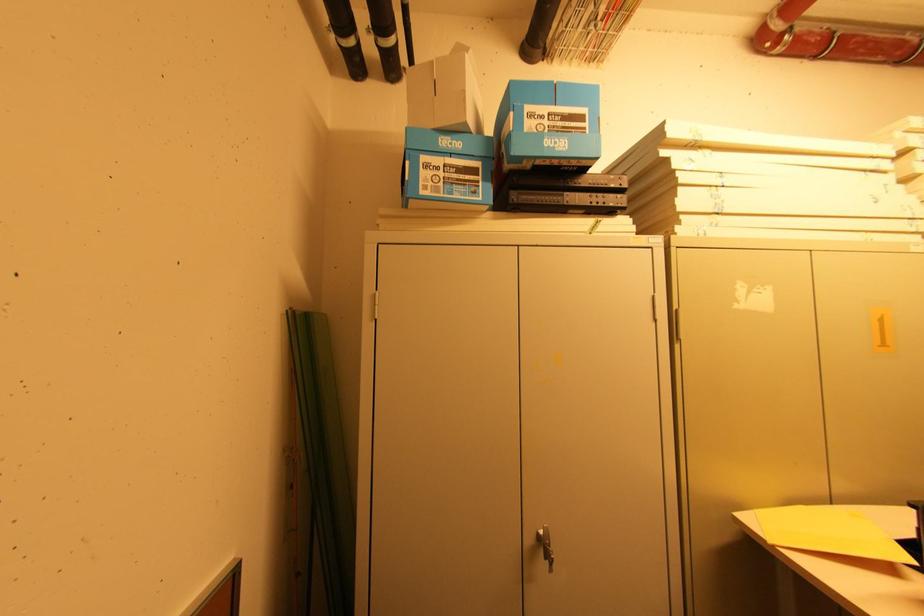
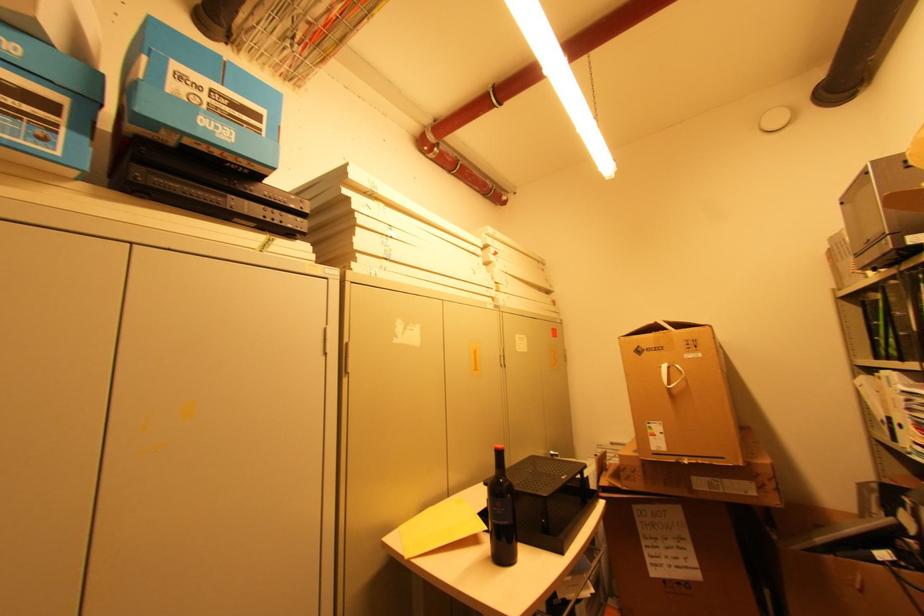
Question: The camera is either moving clockwise (left) or counter-clockwise (right) around the object. The first image is from the beginning of the video and the second image is from the end. Is the camera moving left or right when shooting the video?

Choices:
 (A) Left
 (B) Right

Answer: (A)